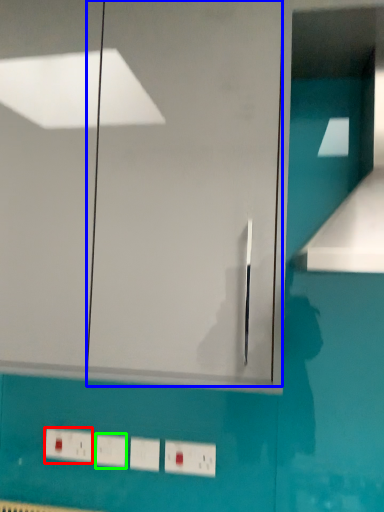
Question: Estimate the real-world distances between objects in this image. Which object is farther from electric outlet (highlighted by a red box), glass door (highlighted by a blue box) or light switch (highlighted by a green box)?

Choices:
 (A) glass door
 (B) light switch

Answer: (A)